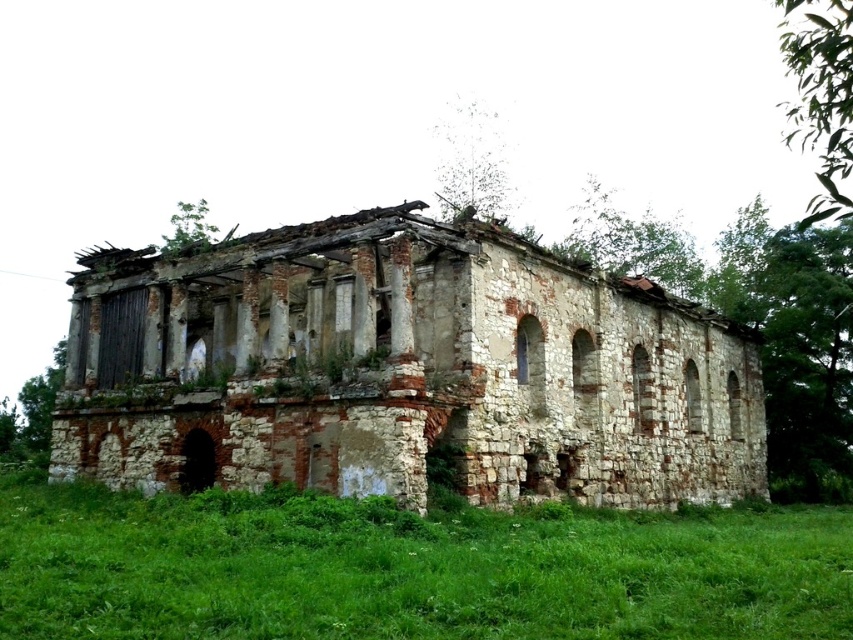
Does weathered stone ruins at center come behind green grass at lower center?

Yes, weathered stone ruins at center is further from the viewer.

Who is more distant from viewer, (258,292) or (138,563)?

Positioned behind is point (258,292).

Locate an element on the screen. weathered stone ruins at center is located at coordinates (402, 371).